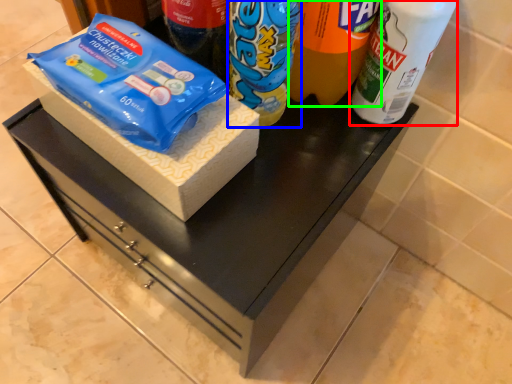
Question: Estimate the real-world distances between objects in this image. Which object is farther from bottle (highlighted by a red box), yoghurt (highlighted by a blue box) or drinking straw (highlighted by a green box)?

Choices:
 (A) yoghurt
 (B) drinking straw

Answer: (A)